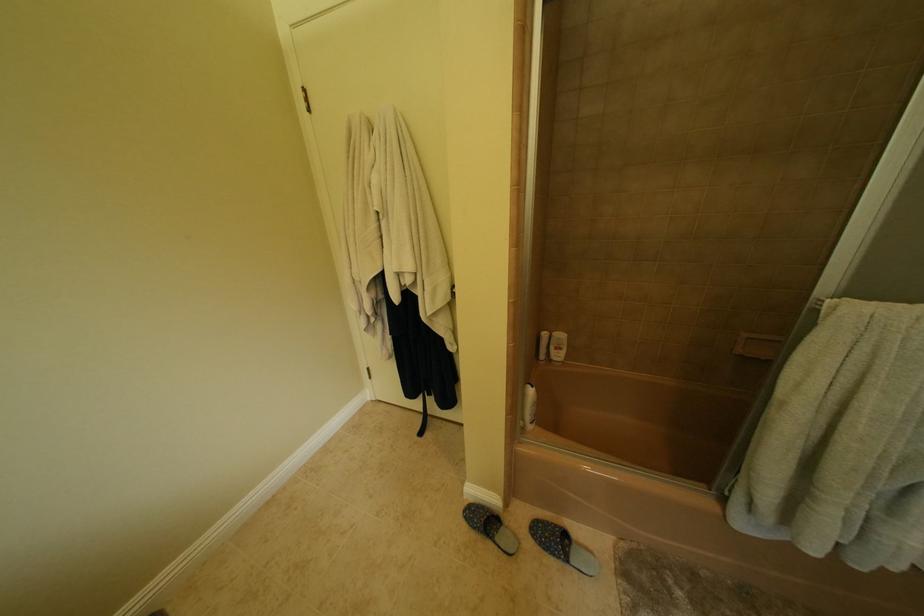
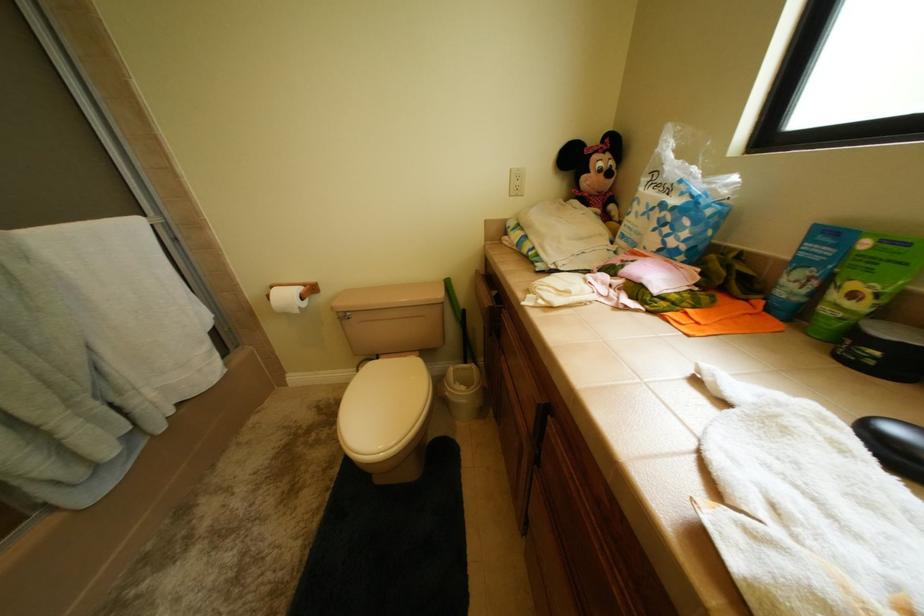
Looking at this image, the first image is from the beginning of the video and the second image is from the end. How did the camera likely rotate when shooting the video?

The rotation direction of the camera is right-down.